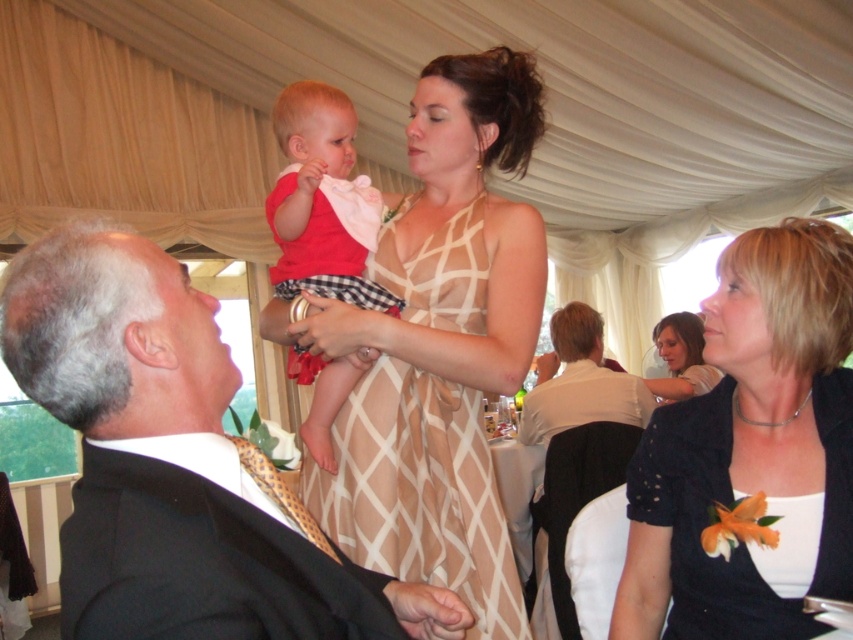
Question: Can you confirm if beige/white textured dress at center is positioned to the right of red cotton shirt at center?

Choices:
 (A) yes
 (B) no

Answer: (A)

Question: Which object is farther from the camera taking this photo?

Choices:
 (A) matte black dress at lower right
 (B) matte gold tie at left
 (C) matte white dress at upper right
 (D) beige/white textured dress at center

Answer: (C)

Question: Which point is farther to the camera?

Choices:
 (A) (827, 230)
 (B) (335, 156)

Answer: (B)

Question: Is matte black dress at lower right thinner than gold textured tie at lower left?

Choices:
 (A) yes
 (B) no

Answer: (B)

Question: From the image, what is the correct spatial relationship of beige/white textured dress at center in relation to red cotton shirt at center?

Choices:
 (A) below
 (B) above

Answer: (A)

Question: Among these objects, which one is farthest from the camera?

Choices:
 (A) matte black dress at lower right
 (B) red cotton shirt at center

Answer: (B)